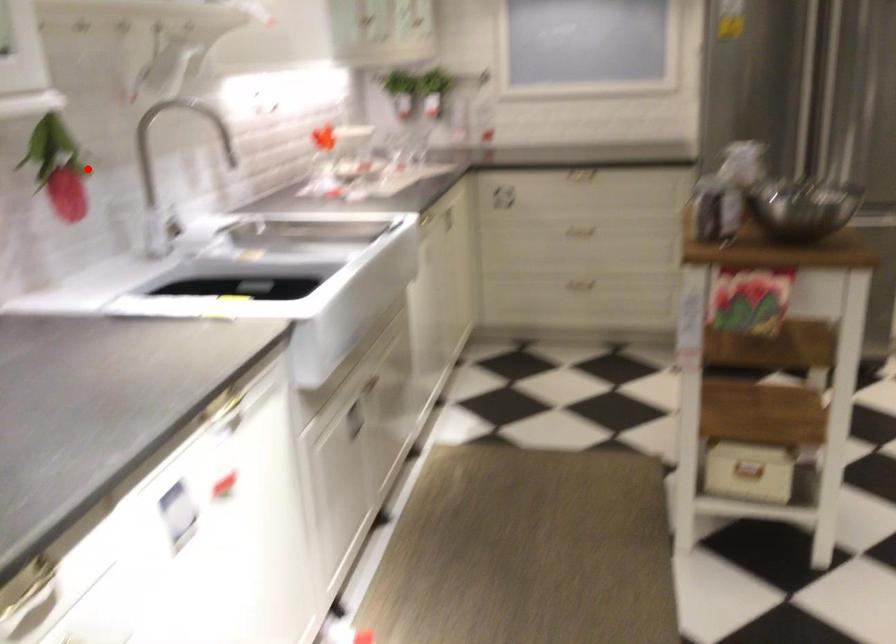
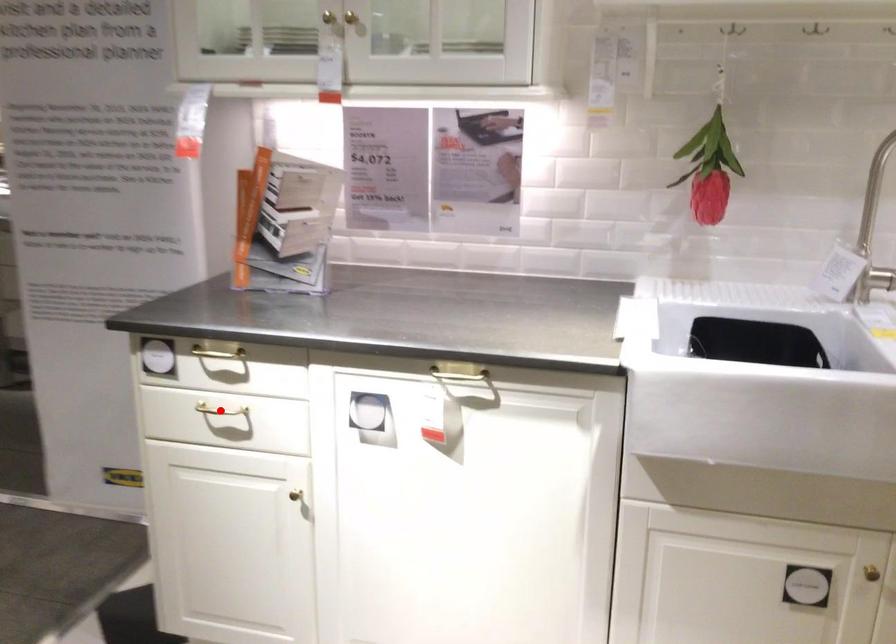
I am providing you with two images of the same scene from different viewpoints. A red point is marked on the first image and another point is marked on the second image. Is the marked point in image1 the same physical position as the marked point in image2?

No